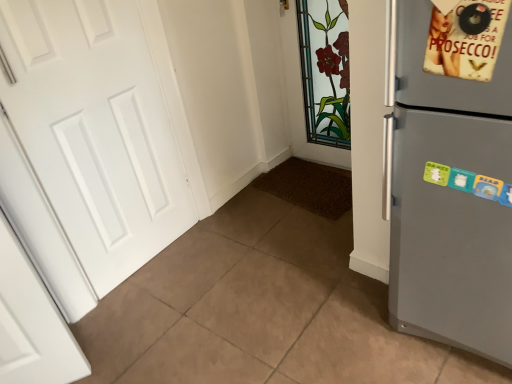
Measure the distance between point (465,269) and camera.

Point (465,269) and camera are 3.77 feet apart from each other.

Measure the distance between white matte door at left and camera.

white matte door at left and camera are 1.28 meters apart.

Image resolution: width=512 pixels, height=384 pixels. Find the location of `satin grey fridge at right`. satin grey fridge at right is located at coordinates (447, 194).

Is white matte door at left at the back of beige paper poster at upper right?

No.

Based on the photo, how many degrees apart are the facing directions of beige paper poster at upper right and white matte door at left?

The angle between the facing direction of beige paper poster at upper right and the facing direction of white matte door at left is 93 degrees.

Between beige paper poster at upper right and white matte door at left, which one has larger size?

Bigger between the two is white matte door at left.

From a real-world perspective, is beige paper poster at upper right located higher than white matte door at left?

Yes.

Who is taller, white matte door at left or beige paper poster at upper right?

white matte door at left.

Is white matte door at left behind beige paper poster at upper right?

Yes, white matte door at left is behind beige paper poster at upper right.

Which object is positioned more to the right, white matte door at left or beige paper poster at upper right?

Positioned to the right is beige paper poster at upper right.

Which object is wider, white matte door at left or beige paper poster at upper right?

beige paper poster at upper right.

Is satin grey fridge at right looking in the opposite direction of white matte door at left?

That's not correct — satin grey fridge at right is not looking away from white matte door at left.

Is satin grey fridge at right situated inside white matte door at left or outside?

satin grey fridge at right is not enclosed by white matte door at left.

Measure the distance from satin grey fridge at right to white matte door at left.

The distance of satin grey fridge at right from white matte door at left is 1.18 meters.

Does point (15, 112) come farther from viewer compared to point (426, 195)?

Yes.

Does white matte door at left have a greater height compared to satin grey fridge at right?

Indeed, white matte door at left has a greater height compared to satin grey fridge at right.

Which of these two, white matte door at left or satin grey fridge at right, is bigger?

satin grey fridge at right is bigger.

Does satin grey fridge at right have a lesser width compared to beige paper poster at upper right?

In fact, satin grey fridge at right might be wider than beige paper poster at upper right.

Is satin grey fridge at right next to beige paper poster at upper right and touching it?

No, satin grey fridge at right is not with beige paper poster at upper right.

How many degrees apart are the facing directions of satin grey fridge at right and beige paper poster at upper right?

satin grey fridge at right and beige paper poster at upper right are facing 0.88 degrees away from each other.

In terms of size, does satin grey fridge at right appear bigger or smaller than beige paper poster at upper right?

satin grey fridge at right is bigger than beige paper poster at upper right.

Does beige paper poster at upper right lie behind satin grey fridge at right?

Yes, beige paper poster at upper right is further from the camera.

Considering the positions of objects beige paper poster at upper right and satin grey fridge at right in the image provided, who is more to the left, beige paper poster at upper right or satin grey fridge at right?

From the viewer's perspective, beige paper poster at upper right appears more on the left side.

Is satin grey fridge at right at the back of beige paper poster at upper right?

Yes, satin grey fridge at right is at the back of beige paper poster at upper right.

Is point (432, 50) farther from viewer compared to point (403, 176)?

That is False.

I want to click on door that is under the beige paper poster at upper right (from a real-world perspective), so click(96, 130).

At what (x,y) coordinates should I click in order to perform the action: click on door that is below the beige paper poster at upper right (from the image's perspective). Please return your answer as a coordinate pair (x, y). This screenshot has width=512, height=384. Looking at the image, I should click on (96, 130).

Looking at the image, which one is located closer to beige paper poster at upper right, satin grey fridge at right or white matte door at left?

Among the two, satin grey fridge at right is located nearer to beige paper poster at upper right.

When comparing their distances from beige paper poster at upper right, does white matte door at left or satin grey fridge at right seem further?

white matte door at left is positioned further to the anchor beige paper poster at upper right.

Considering their positions, is beige paper poster at upper right positioned further to white matte door at left than satin grey fridge at right?

beige paper poster at upper right is positioned further to the anchor white matte door at left.

When comparing their distances from satin grey fridge at right, does beige paper poster at upper right or white matte door at left seem further?

Among the two, white matte door at left is located further to satin grey fridge at right.

Which object lies further to the anchor point white matte door at left, satin grey fridge at right or beige paper poster at upper right?

Among the two, beige paper poster at upper right is located further to white matte door at left.

When comparing their distances from satin grey fridge at right, does white matte door at left or beige paper poster at upper right seem closer?

Based on the image, beige paper poster at upper right appears to be nearer to satin grey fridge at right.

Where is `postcard located between white matte door at left and satin grey fridge at right in the left-right direction`? This screenshot has width=512, height=384. postcard located between white matte door at left and satin grey fridge at right in the left-right direction is located at coordinates (466, 39).